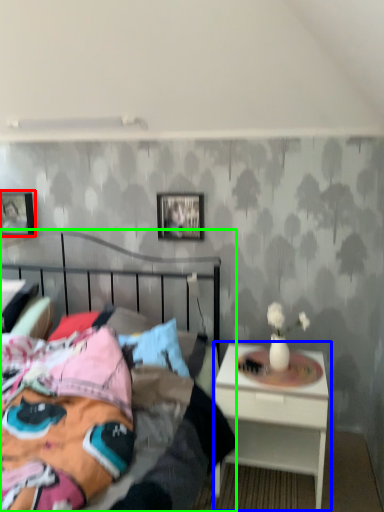
Question: Which object is positioned closest to picture frame (highlighted by a red box)? Select from nightstand (highlighted by a blue box) and bed (highlighted by a green box).

Choices:
 (A) nightstand
 (B) bed

Answer: (B)